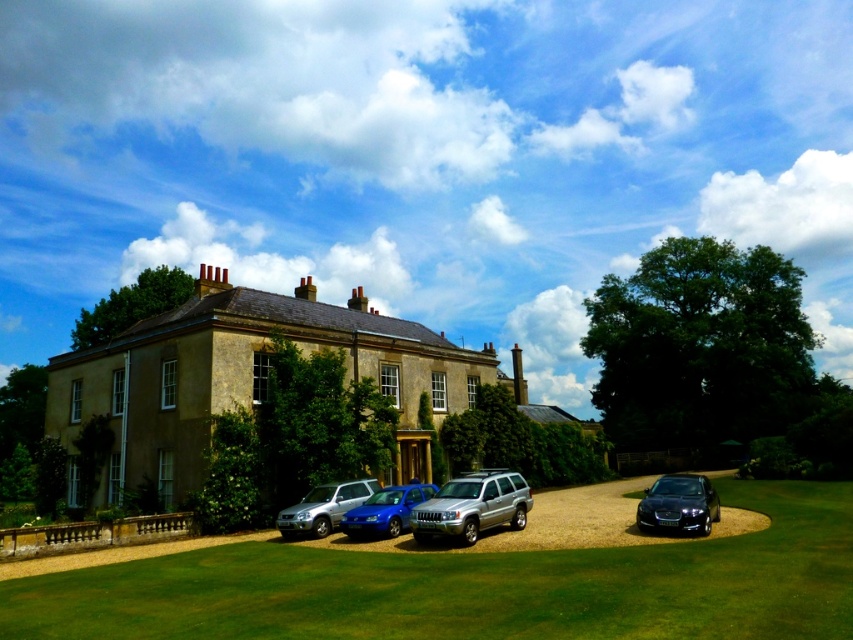
Is silver metallic suvs at center thinner than satin silver suv at lower left?

No.

Can you confirm if silver metallic suvs at center is positioned to the right of satin silver suv at lower left?

Indeed, silver metallic suvs at center is positioned on the right side of satin silver suv at lower left.

Between point (525, 541) and point (306, 499), which one is positioned behind?

Positioned behind is point (306, 499).

Locate an element on the screen. The height and width of the screenshot is (640, 853). silver metallic suvs at center is located at coordinates (573, 520).

Measure the distance from glossy black car at lower right to metallic blue sedan at center.

glossy black car at lower right is 13.76 meters away from metallic blue sedan at center.

Which is below, glossy black car at lower right or metallic blue sedan at center?

Positioned lower is glossy black car at lower right.

This screenshot has width=853, height=640. I want to click on glossy black car at lower right, so click(x=679, y=504).

Which is above, silver metallic suvs at center or silver metallic suv at center?

silver metallic suv at center is above.

Who is more distant from viewer, (386, 540) or (482, 509)?

Positioned behind is point (386, 540).

In order to click on silver metallic suvs at center in this screenshot , I will do `click(573, 520)`.